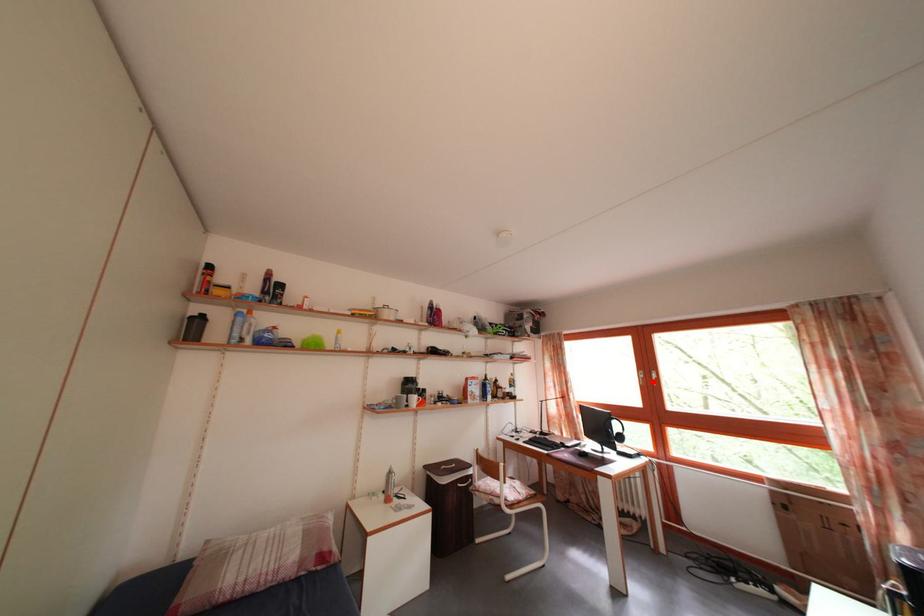
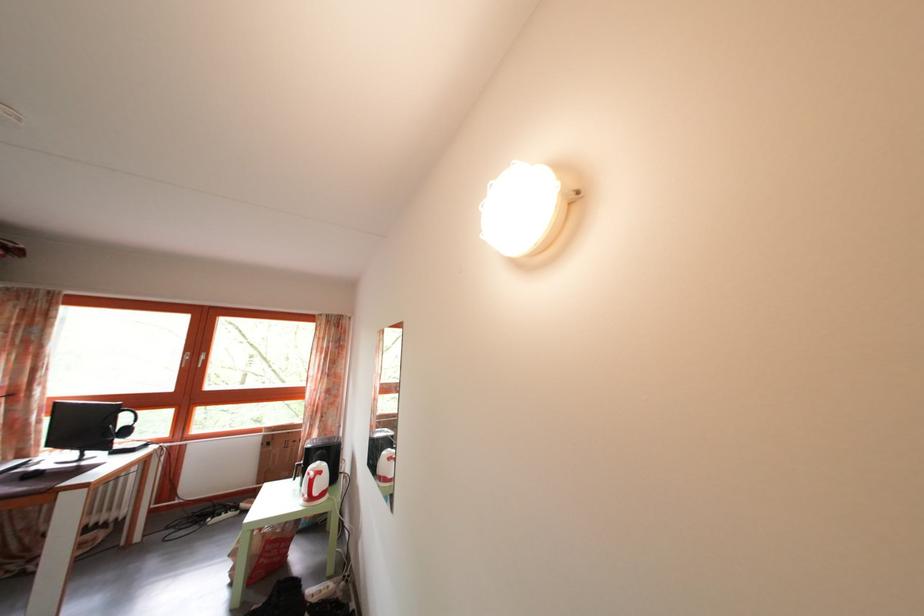
Where in the second image is the point corresponding to the highlighted location from the first image?

(199, 363)